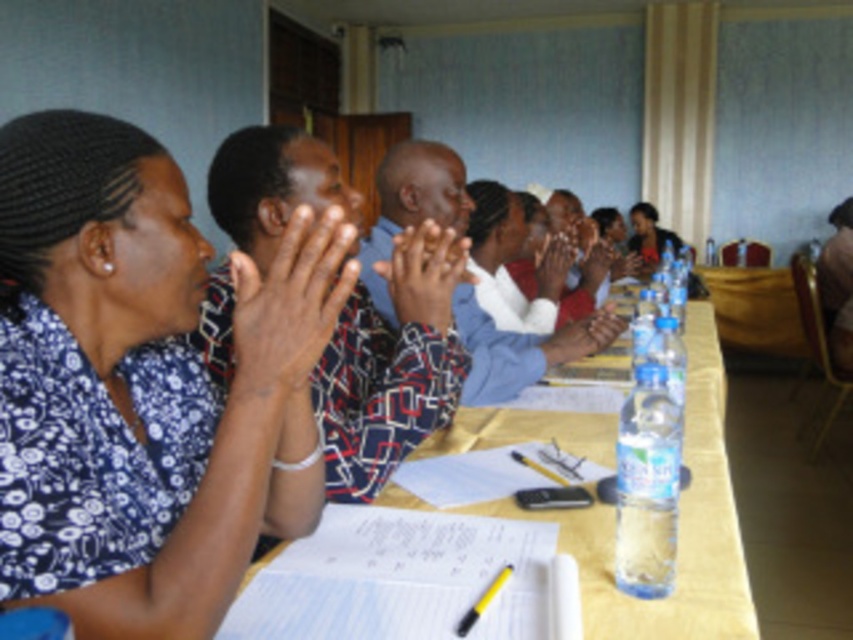
Does blue floral shirt at center have a smaller size compared to matte skin hand at center?

Actually, blue floral shirt at center might be larger than matte skin hand at center.

Can you confirm if blue floral shirt at center is thinner than matte skin hand at center?

In fact, blue floral shirt at center might be wider than matte skin hand at center.

Find the location of a particular element. blue floral shirt at center is located at coordinates (135, 380).

Which is behind, point (347, 211) or point (387, 259)?

The point (387, 259) is behind.

Is blue printed shirt at center thinner than matte plastic hands at center?

In fact, blue printed shirt at center might be wider than matte plastic hands at center.

Identify the location of blue printed shirt at center. (390, 365).

I want to click on blue printed shirt at center, so click(x=390, y=365).

Is point (604, 513) closer to viewer compared to point (589, 316)?

Yes, point (604, 513) is closer to viewer.

Does yellow matte table at center appear on the right side of matte black hands at center?

Yes, yellow matte table at center is to the right of matte black hands at center.

Which is in front, point (587, 422) or point (608, 342)?

Point (587, 422) is more forward.

Locate an element on the screen. yellow matte table at center is located at coordinates (677, 529).